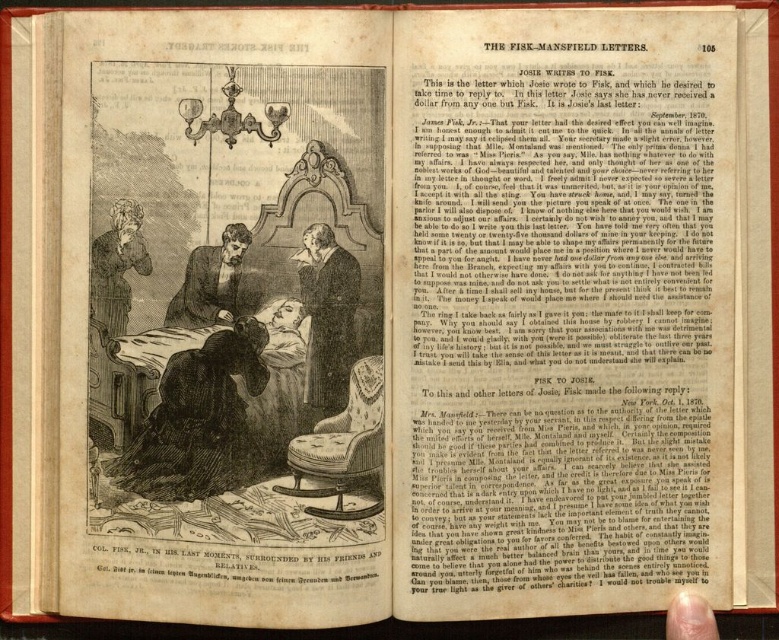
Looking at this image, you are an art student analyzing the illustration in the book. You notice two points marked in the image. The first point is at coordinates point (175, 300) and the second is at point (693, 612). Which of these points is closer to you as you look at the illustration?

Point (175, 300) is closer to you than point (693, 612) because it is further to the viewer in the illustration.

You are an assistant organizing a historical clothing exhibit. You need to place the smooth black coat at center and the dark brown leather jacket at center on a display mannequin. Which clothing item should you place first if you want to layer them properly?

The smooth black coat at center should be placed first because it is smaller than the dark brown leather jacket at center, allowing the larger jacket to be layered over it.

You are a tailor measuring the distance between the dark brown leather jacket at center and the smooth pinkish skin at lower right for a custom fit. Can a 16 inch measuring tape reach between them?

The distance between the dark brown leather jacket at center and the smooth pinkish skin at lower right is 15.93 inches. Since the measuring tape is 16 inches long, it can just barely reach between them.